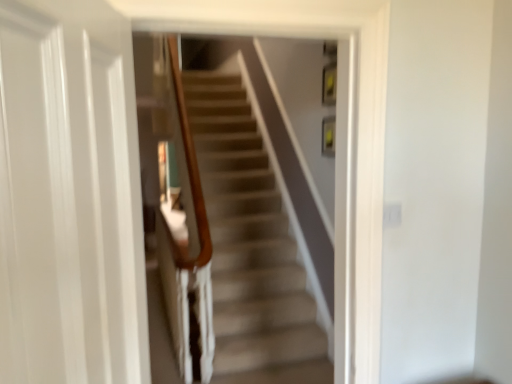
Question: Should I look upward or downward to see transparent glass door at left?

Choices:
 (A) down
 (B) up

Answer: (A)